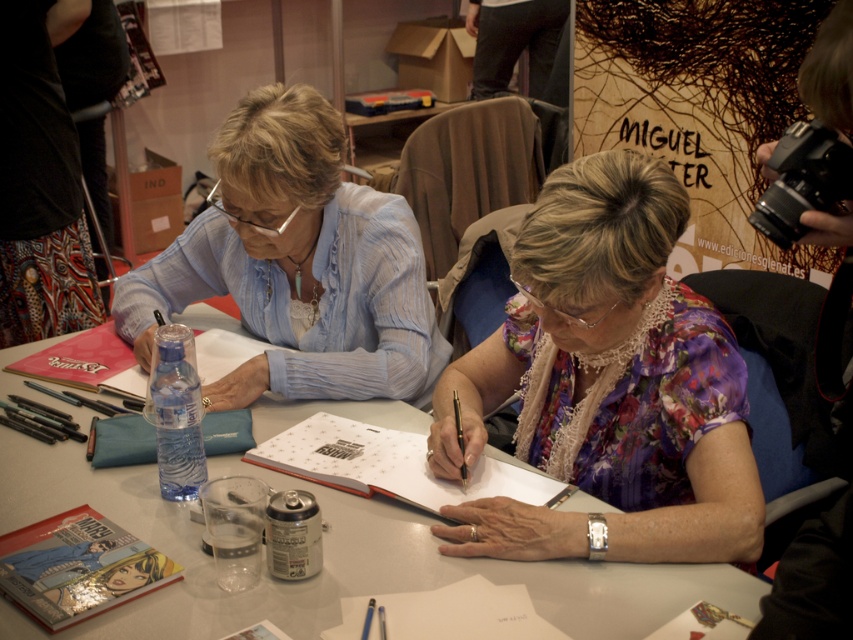
Is floral silk blouse at center taller than white paper at center?

Yes.

Can you confirm if floral silk blouse at center is bigger than white paper at center?

Indeed, floral silk blouse at center has a larger size compared to white paper at center.

The image size is (853, 640). I want to click on floral silk blouse at center, so click(607, 385).

Find the location of a particular element. The width and height of the screenshot is (853, 640). floral silk blouse at center is located at coordinates (607, 385).

Is floral silk blouse at center smaller than white glossy table at center?

Indeed, floral silk blouse at center has a smaller size compared to white glossy table at center.

Is floral silk blouse at center further to the viewer compared to white glossy table at center?

That is True.

Who is more forward, (717, 540) or (79, 449)?

Point (717, 540)

The height and width of the screenshot is (640, 853). I want to click on floral silk blouse at center, so click(x=607, y=385).

Is white glossy table at center below matte blue shirt at center?

Correct, white glossy table at center is located below matte blue shirt at center.

Which is in front, point (334, 408) or point (328, 321)?

Positioned in front is point (334, 408).

At what (x,y) coordinates should I click in order to perform the action: click on white glossy table at center. Please return your answer as a coordinate pair (x, y). This screenshot has width=853, height=640. Looking at the image, I should click on (334, 557).